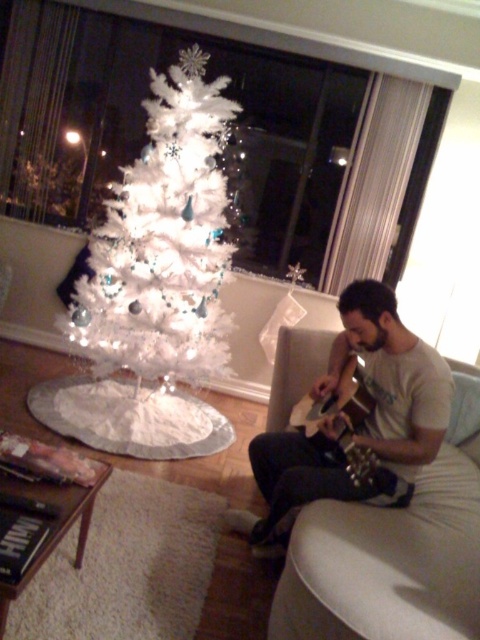
Does point (188, 148) come closer to viewer compared to point (310, 445)?

No.

Is the position of white feathered tree at center less distant than that of beige cotton shirt at center?

That is False.

Is point (120, 292) farther from viewer compared to point (387, 355)?

Yes, it is.

Find the location of a particular element. The width and height of the screenshot is (480, 640). white feathered tree at center is located at coordinates click(164, 243).

Between point (432, 387) and point (337, 419), which one is positioned behind?

The point (337, 419) is behind.

Can you confirm if beige cotton shirt at center is positioned above matte brown acoustic guitar at center-right?

Actually, beige cotton shirt at center is below matte brown acoustic guitar at center-right.

What do you see at coordinates (363, 420) in the screenshot? The width and height of the screenshot is (480, 640). I see `beige cotton shirt at center` at bounding box center [363, 420].

You are a GUI agent. You are given a task and a screenshot of the screen. Output one action in this format:
    pyautogui.click(x=<x>, y=<y>)
    Task: Click on the beige cotton shirt at center
    The image size is (480, 640).
    Given the screenshot: What is the action you would take?
    pyautogui.click(x=363, y=420)

Is point (160, 348) positioned in front of point (349, 444)?

That is False.

Looking at this image, does white feathered tree at center appear under matte brown acoustic guitar at center-right?

Actually, white feathered tree at center is above matte brown acoustic guitar at center-right.

Locate an element on the screen. white feathered tree at center is located at coordinates (164, 243).